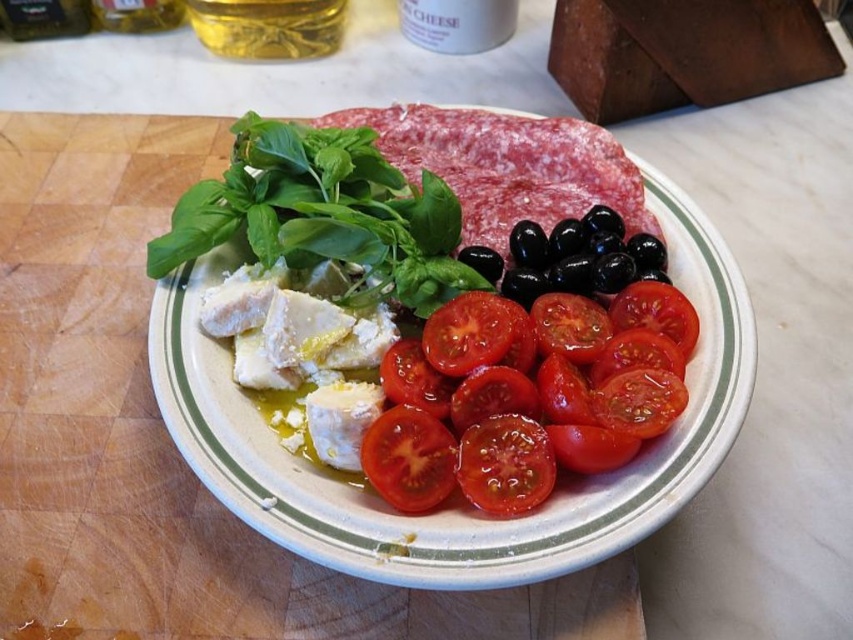
Question: Which point is closer to the camera taking this photo?

Choices:
 (A) (326, 394)
 (B) (521, 422)
 (C) (585, 413)

Answer: (C)

Question: Is the position of green leafy basil at upper left less distant than that of bright red tomato at lower center?

Choices:
 (A) no
 (B) yes

Answer: (A)

Question: Does white creamy cheese at center have a larger size compared to golden liquid at top?

Choices:
 (A) no
 (B) yes

Answer: (B)

Question: Which of the following is the closest to the observer?

Choices:
 (A) sliced glossy tomato at center
 (B) white creamy cheese at center
 (C) white ceramic plate at center
 (D) bright red tomato at lower center

Answer: (C)

Question: Is white creamy cheese at center to the right of sliced glossy tomato at lower center from the viewer's perspective?

Choices:
 (A) no
 (B) yes

Answer: (A)

Question: Which point is farther to the camera?

Choices:
 (A) (546, 492)
 (B) (434, 170)
 (C) (404, 426)
 (D) (289, 326)

Answer: (B)